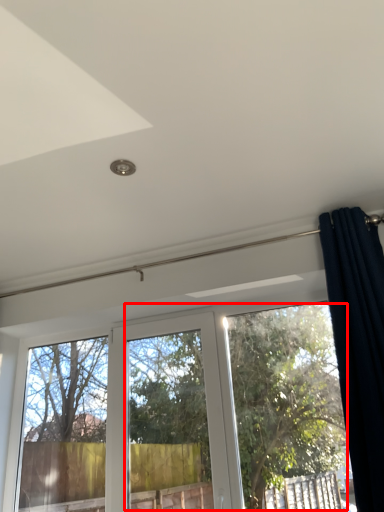
Question: Considering the relative positions of tree (annotated by the red box) and curtain in the image provided, where is tree (annotated by the red box) located with respect to the staircase?

Choices:
 (A) right
 (B) left

Answer: (B)